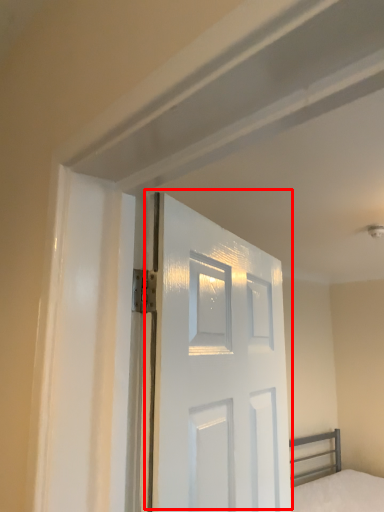
Question: From the image's perspective, what is the correct spatial positioning of door (annotated by the red box) in reference to bed?

Choices:
 (A) below
 (B) above

Answer: (B)